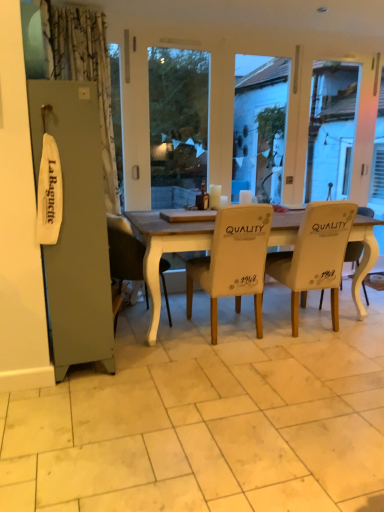
Where is `vacant area on top of white tile at center (from a real-world perspective)`? vacant area on top of white tile at center (from a real-world perspective) is located at coordinates (236, 359).